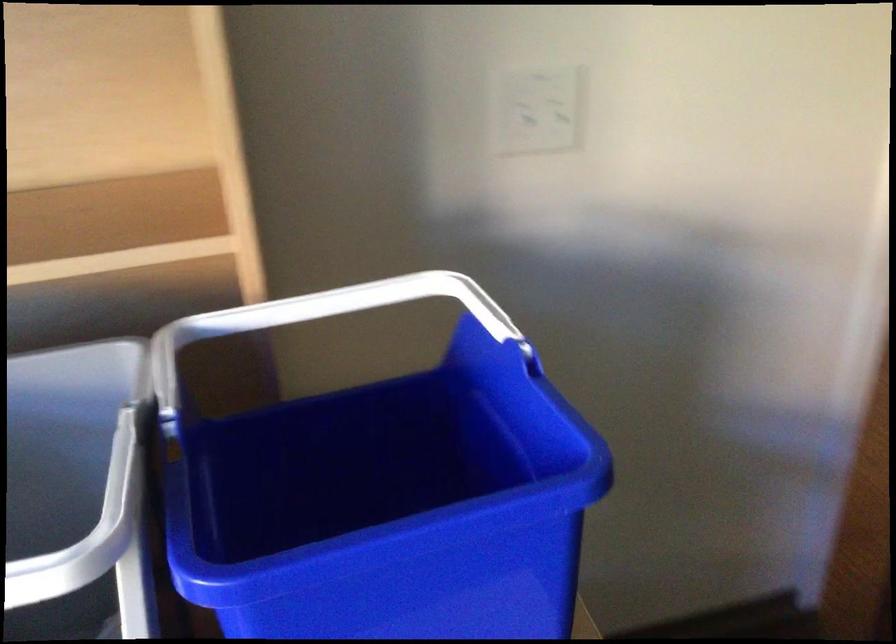
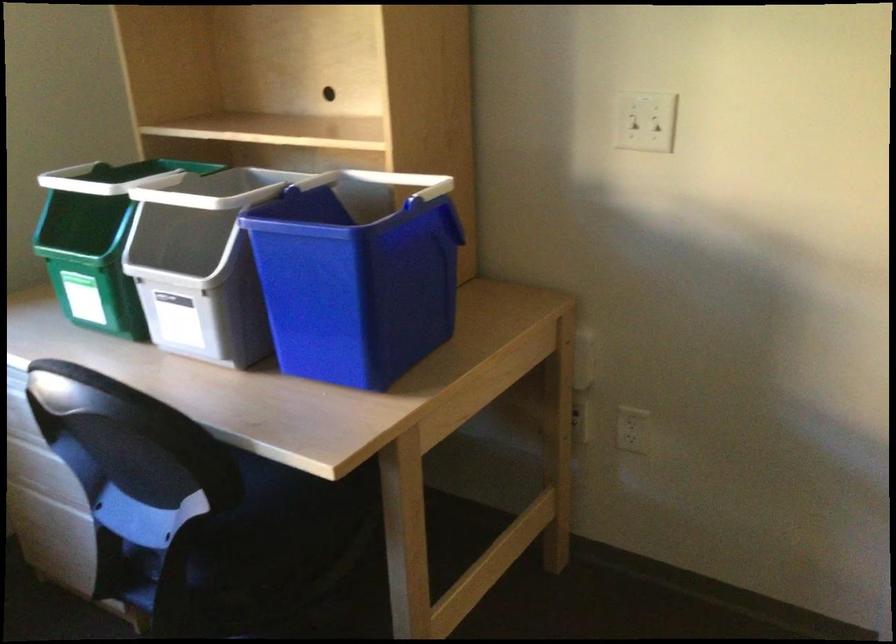
Find the pixel in the second image that matches (325,310) in the first image.

(399, 181)